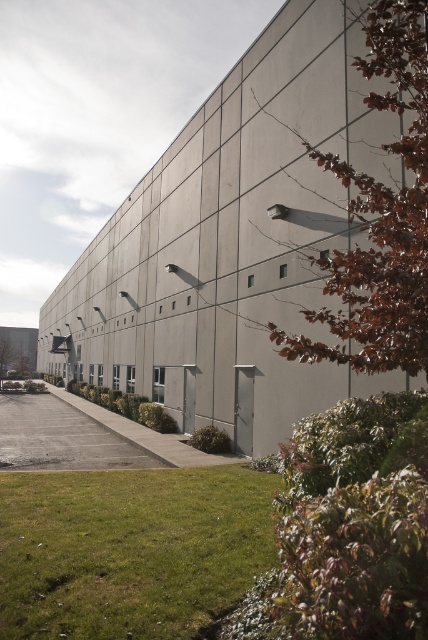
You are a landscape architect planning to install a new garden bed. You have a rectangular garden bed that is 10 meters long. You want to place it either along the gray concrete building at center or on the green grass at lower left. Based on their sizes, which location would allow the garden bed to fit better?

The gray concrete building at center is wider than the green grass at lower left, so placing the 10 meter long garden bed along the gray concrete building at center would provide more space and allow it to fit better.